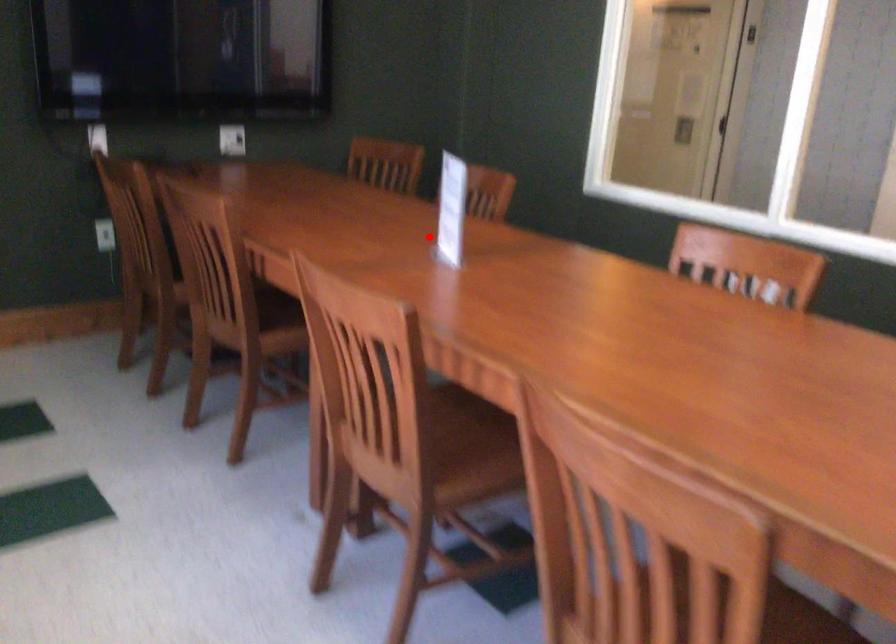
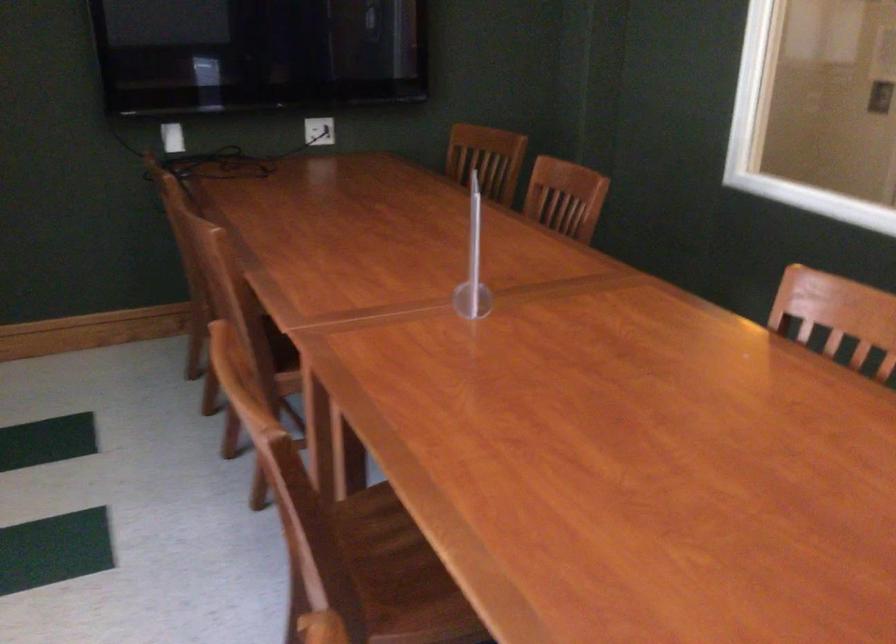
Question: I am providing you with two images of the same scene from different viewpoints. A red point is marked on the first image. At the location where the point appears in image 1, is it still visible in image 2?

Choices:
 (A) Yes
 (B) No

Answer: (A)